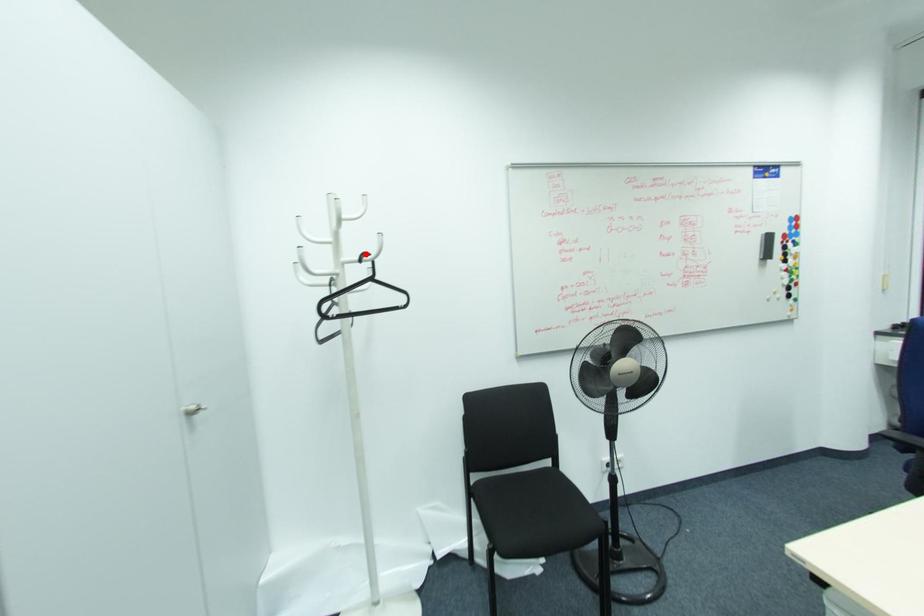
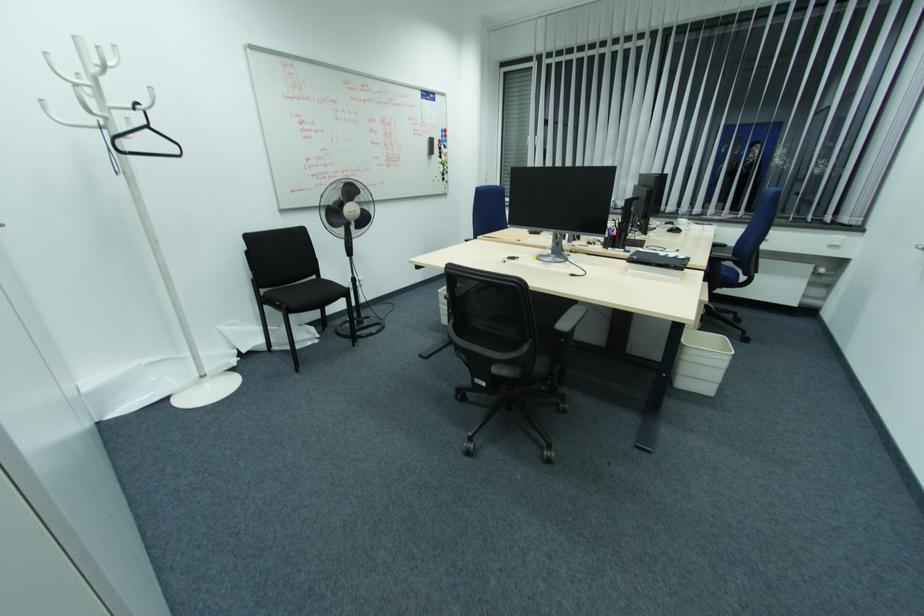
Question: I am providing you with two images of the same scene from different viewpoints. In image1, a red point is highlighted. Considering the same 3D point in image2, which of the following is correct?

Choices:
 (A) It is closer
 (B) It is farther

Answer: (B)